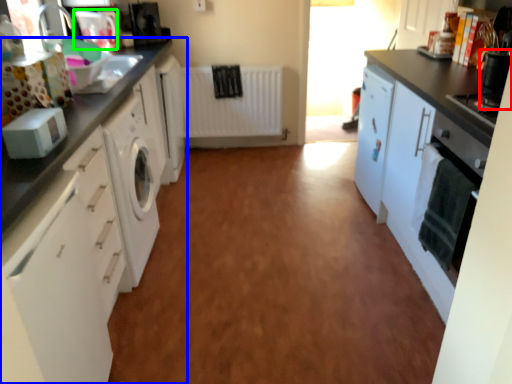
Question: Which object is the closest to the appliance (highlighted by a red box)? Choose among these: cabinetry (highlighted by a blue box) or appliance (highlighted by a green box).

Choices:
 (A) cabinetry
 (B) appliance

Answer: (A)